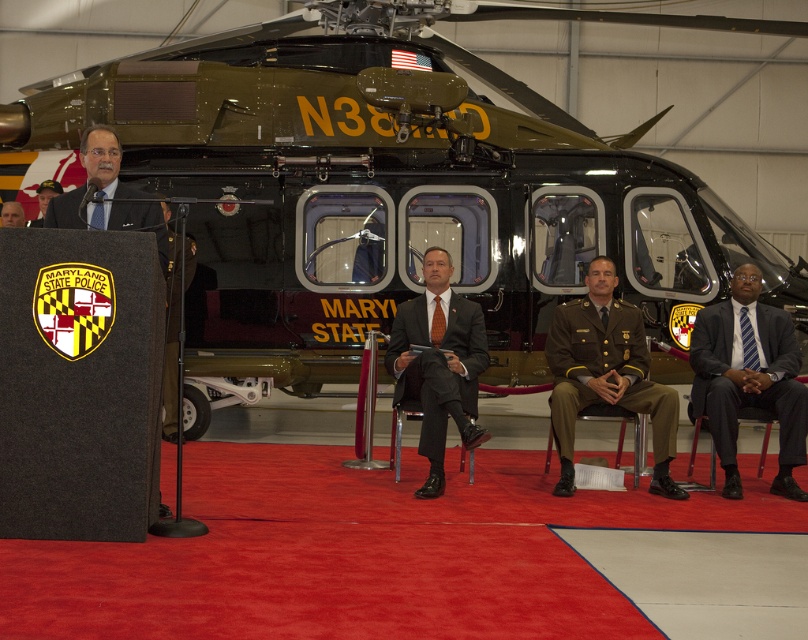
You are attending a formal event at the Maryland State Police hangar. You see a green matte helicopter at center and a matte black suit at center. Which object is positioned higher in the scene?

The green matte helicopter at center is positioned higher than the matte black suit at center in the scene.

You are a photographer at the event and want to capture both the dark blue suit at center and the green fabric uniform at center in a single photo. The camera you have can focus on subjects within a 10 feet range. Will you be able to capture both in focus?

The distance between the dark blue suit at center and the green fabric uniform at center is 11.63 feet, which exceeds the camera focus range of 10 feet. Therefore, you won

You are standing in front of the Maryland State Police helicopter at the event. There are two points marked in the scene. The first point is at coordinate point (86, 109) and the second point is at coordinate point (747, 349). Which point is closer to you?

Point (86, 109) is closer to you because it is further to the viewer than point (747, 349).